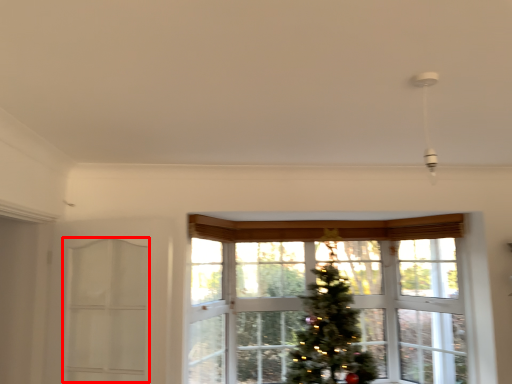
Question: Observing the image, what is the correct spatial positioning of screen door (annotated by the red box) in reference to window?

Choices:
 (A) right
 (B) left

Answer: (B)